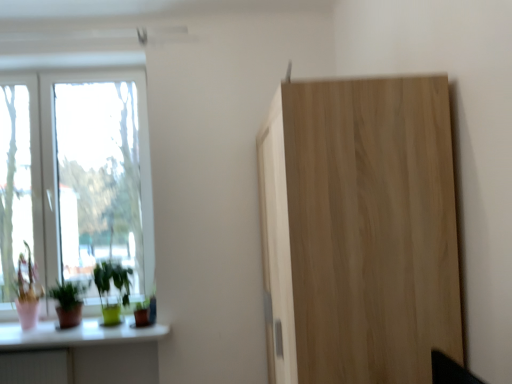
The image size is (512, 384). Find the location of `empty space that is ontop of white glass window at left, which ranks as the 2th window in left-to-right order (from a real-world perspective)`. empty space that is ontop of white glass window at left, which ranks as the 2th window in left-to-right order (from a real-world perspective) is located at coordinates (91, 66).